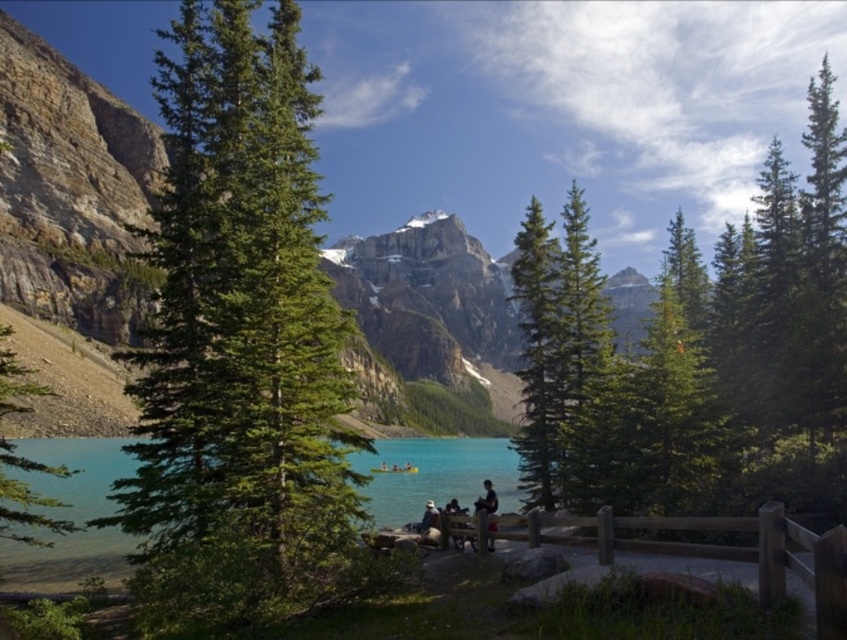
Question: Which of the following is the farthest from the observer?

Choices:
 (A) (248, 198)
 (B) (616, 490)
 (C) (486, 499)

Answer: (C)

Question: Is green textured tree at left thinner than green matte tree at lower left?

Choices:
 (A) no
 (B) yes

Answer: (A)

Question: Can you confirm if green matte tree at center is positioned above green matte tree at lower left?

Choices:
 (A) no
 (B) yes

Answer: (B)

Question: Which of the following is the farthest from the observer?

Choices:
 (A) (524, 396)
 (B) (53, 504)

Answer: (A)

Question: Which of the following is the closest to the observer?

Choices:
 (A) (668, 294)
 (B) (203, 157)
 (C) (0, 488)
 (D) (488, 529)

Answer: (C)

Question: Is green matte tree at upper center below green matte tree at lower left?

Choices:
 (A) no
 (B) yes

Answer: (A)